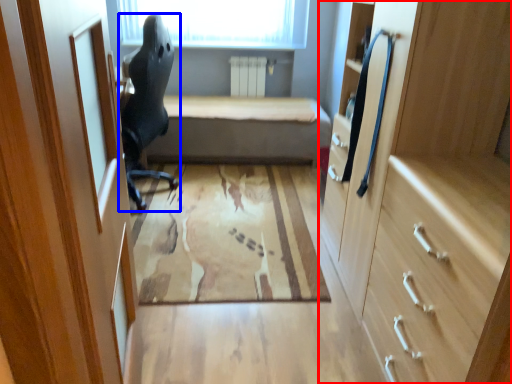
Question: Which object is further to the camera taking this photo, cabinetry (highlighted by a red box) or chair (highlighted by a blue box)?

Choices:
 (A) cabinetry
 (B) chair

Answer: (B)